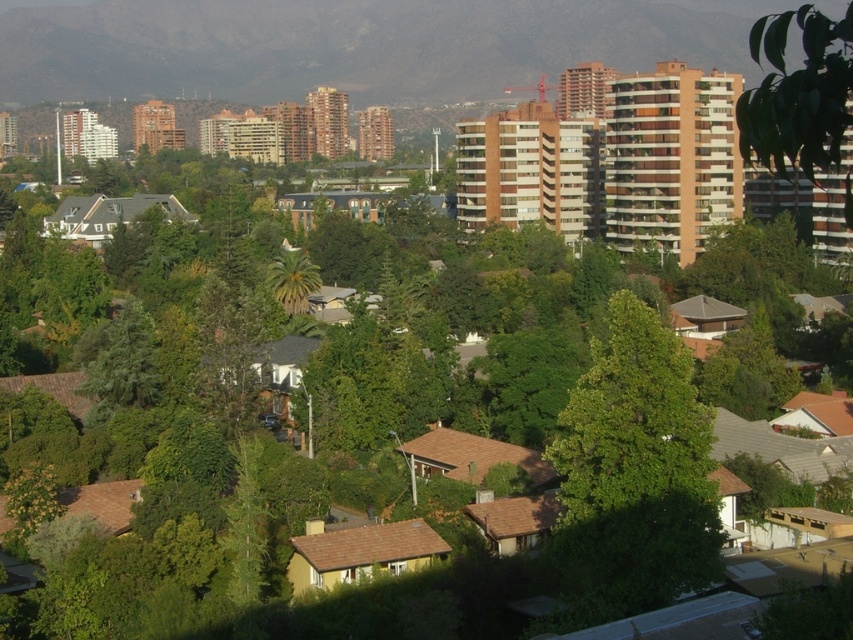
Is green leafy tree at center wider than green leafy tree at upper right?

Incorrect, green leafy tree at center's width does not surpass green leafy tree at upper right's.

Measure the distance between point (x=576, y=589) and camera.

Point (x=576, y=589) is 64.10 meters from camera.

You are a GUI agent. You are given a task and a screenshot of the screen. Output one action in this format:
    pyautogui.click(x=<x>, y=<y>)
    Task: Click on the green leafy tree at center
    
    Given the screenshot: What is the action you would take?
    pyautogui.click(x=633, y=474)

Which is more to the left, green leafy hillside at upper center or green leafy tree at center?

green leafy hillside at upper center is more to the left.

Between green leafy hillside at upper center and green leafy tree at center, which one has more height?

With more height is green leafy hillside at upper center.

Which is behind, point (236, 65) or point (561, 500)?

The point (236, 65) is more distant.

Find the location of `green leafy hillside at upper center`. green leafy hillside at upper center is located at coordinates (354, 44).

Based on the photo, does green leafy hillside at upper center lie behind green leafy tree at upper right?

Yes, it is behind green leafy tree at upper right.

Can you confirm if green leafy hillside at upper center is shorter than green leafy tree at upper right?

Yes, green leafy hillside at upper center is shorter than green leafy tree at upper right.

Find the location of a particular element. green leafy hillside at upper center is located at coordinates (354, 44).

You are a GUI agent. You are given a task and a screenshot of the screen. Output one action in this format:
    pyautogui.click(x=<x>, y=<y>)
    Task: Click on the green leafy hillside at upper center
    
    Given the screenshot: What is the action you would take?
    pyautogui.click(x=354, y=44)